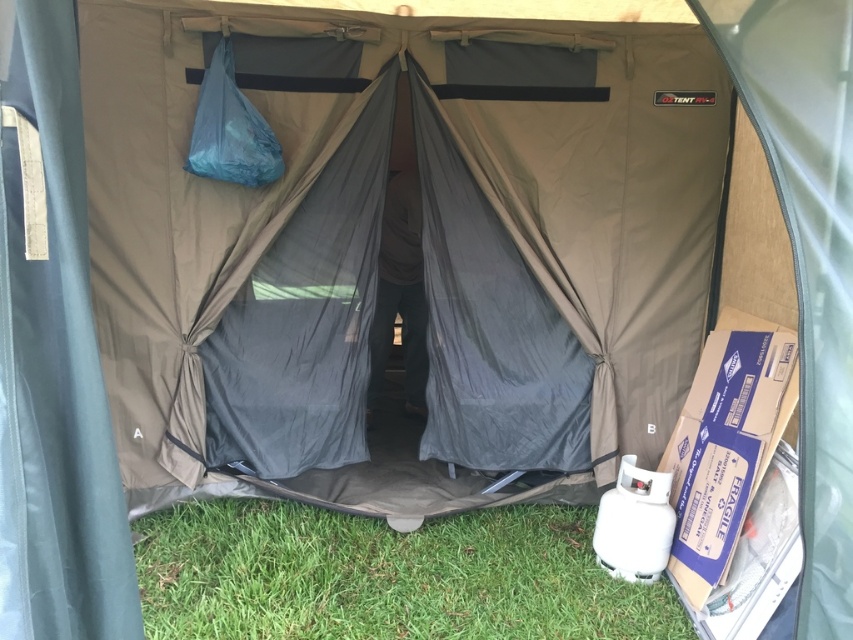
You are setting up a tent and need to place a sleeping bag. Based on the image, is the green grass at lower left closer to you than the blue fabric sleeping bag at upper center?

The green grass at lower left is in front of the blue fabric sleeping bag at upper center, so yes, the green grass at lower left is closer to you.